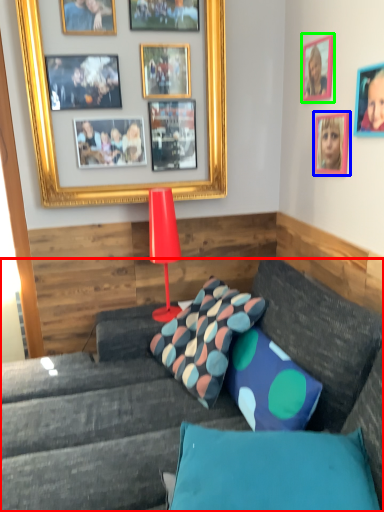
Question: Which object is positioned closest to studio couch (highlighted by a red box)? Select from picture frame (highlighted by a blue box) and picture frame (highlighted by a green box).

Choices:
 (A) picture frame
 (B) picture frame

Answer: (A)